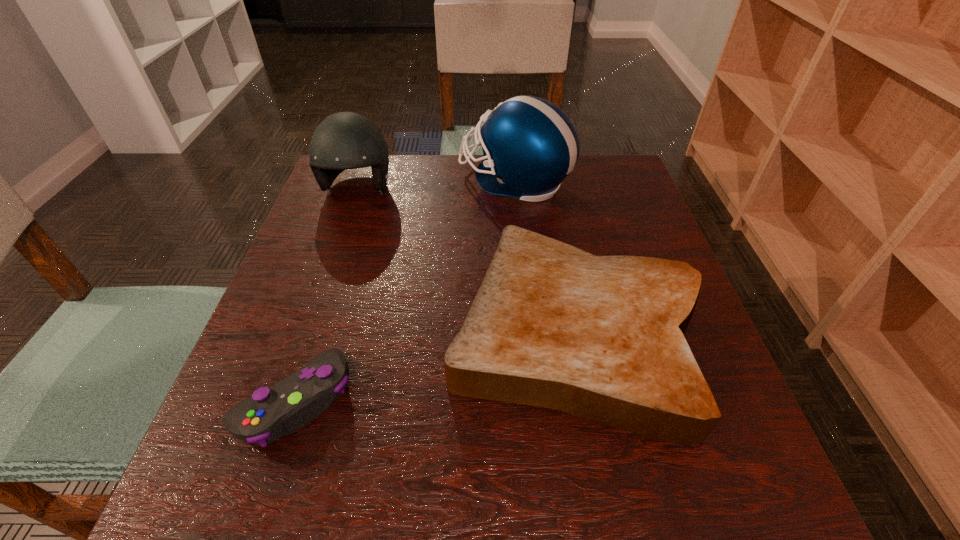
What are the coordinates of `object positioned at the near edge` in the screenshot? It's located at (287, 406).

Image resolution: width=960 pixels, height=540 pixels. Identify the location of football helmet that is positioned at the left edge. (345, 140).

In order to click on control that is at the left edge in this screenshot , I will do `click(287, 406)`.

Locate an element on the screen. object that is at the right edge is located at coordinates (601, 337).

Where is `object at the far left corner`? The image size is (960, 540). object at the far left corner is located at coordinates (345, 140).

Where is `object at the near left corner`? object at the near left corner is located at coordinates (287, 406).

Identify the location of vacant space at the far edge. [468, 180].

At what (x,y) coordinates should I click in order to perform the action: click on vacant area at the near edge. Please return your answer as a coordinate pair (x, y). Looking at the image, I should click on (542, 509).

In the image, there is a desktop. Where is `vacant space at the left edge`? The height and width of the screenshot is (540, 960). vacant space at the left edge is located at coordinates (322, 321).

This screenshot has width=960, height=540. Find the location of `vacant space at the far right corner of the desktop`. vacant space at the far right corner of the desktop is located at coordinates (590, 191).